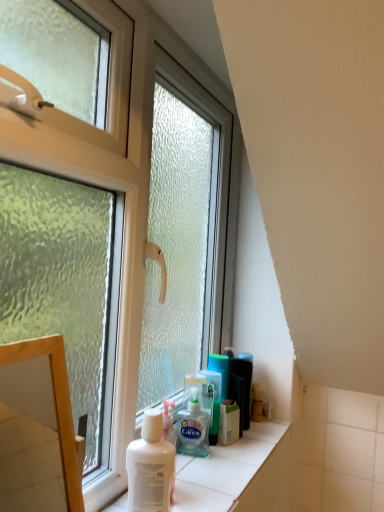
Question: From a real-world perspective, is transparent glass window at center above or below translucent plastic shaving cream at lower center, the first shaving cream viewed from the back?

Choices:
 (A) below
 (B) above

Answer: (B)

Question: From the image's perspective, is transparent glass window at center above or below translucent plastic shaving cream at lower center, positioned as the 2th shaving cream in front-to-back order?

Choices:
 (A) above
 (B) below

Answer: (A)

Question: Which is farther from the wooden frame at left?

Choices:
 (A) transparent glass window at center
 (B) translucent plastic shaving cream at lower center, positioned as the 2th shaving cream in front-to-back order
 (C) white matte shaving cream at lower center, which is counted as the second shaving cream, starting from the back

Answer: (A)

Question: Which object is the farthest from the wooden frame at left?

Choices:
 (A) translucent plastic shaving cream at lower center, positioned as the 2th shaving cream in front-to-back order
 (B) transparent glass window at center
 (C) white matte shaving cream at lower center, which is counted as the second shaving cream, starting from the back

Answer: (B)